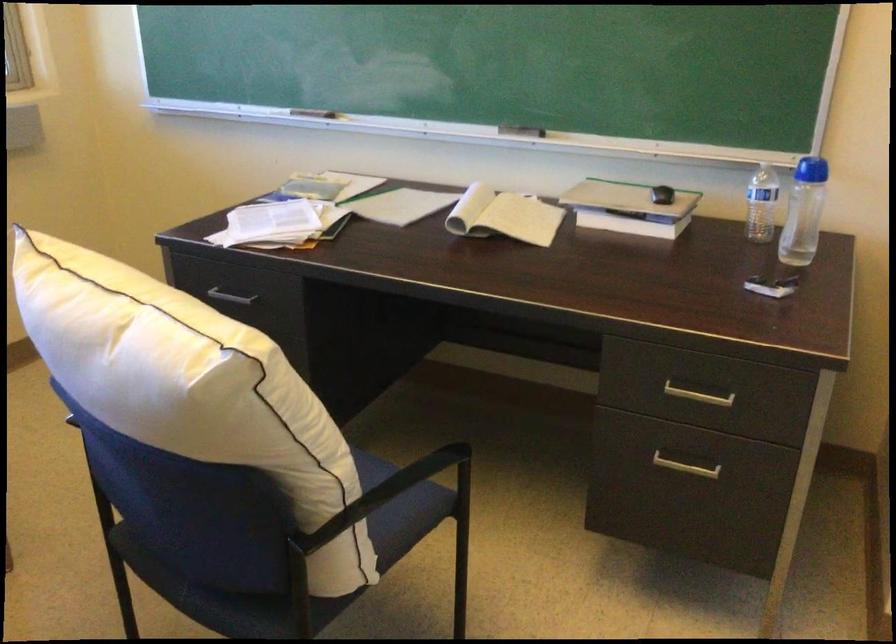
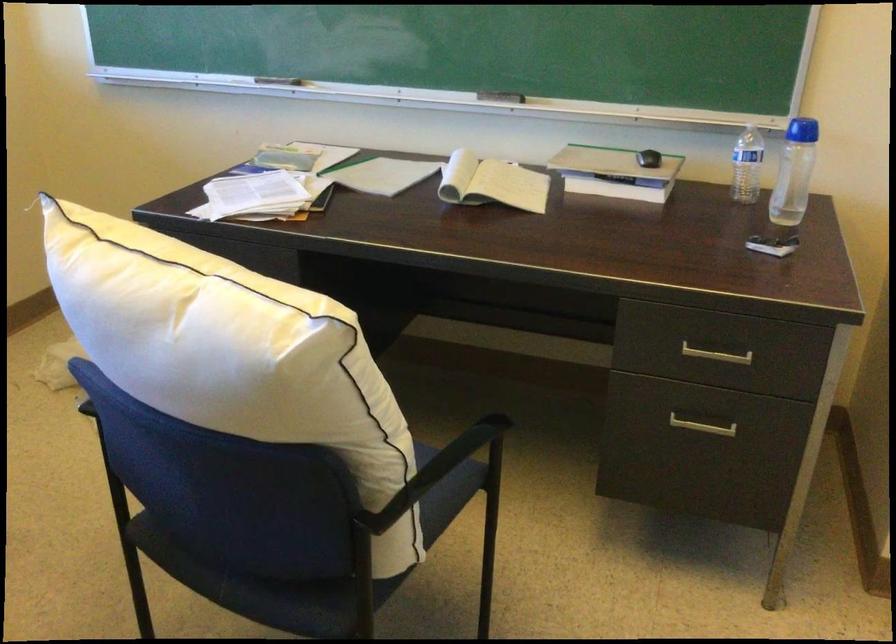
Locate, in the second image, the point that corresponds to (x=622, y=207) in the first image.

(615, 173)